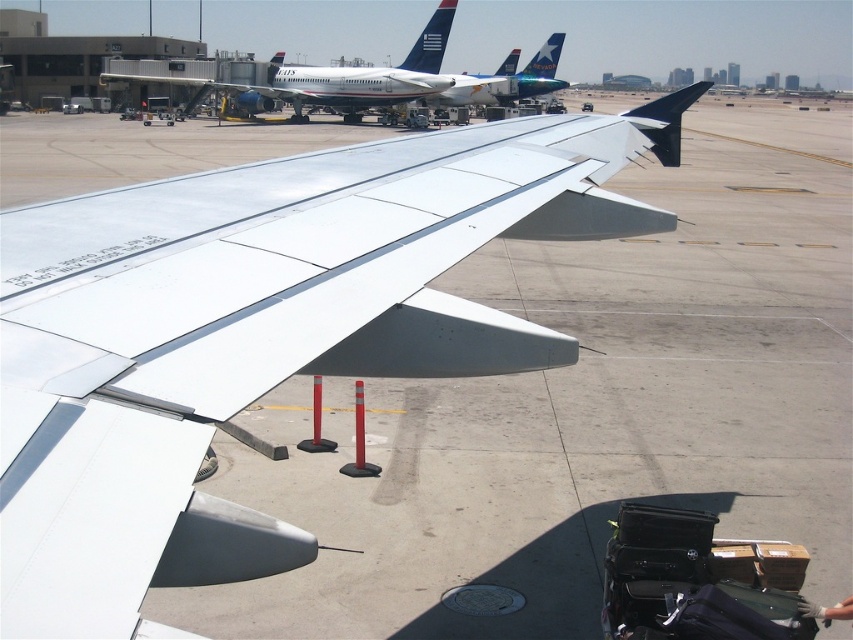
Question: Can you confirm if white matte wing at center is smaller than metallic blue airplane at upper center?

Choices:
 (A) yes
 (B) no

Answer: (A)

Question: Does black hardshell suitcase at lower right have a greater width compared to white matte airplane at upper center?

Choices:
 (A) no
 (B) yes

Answer: (A)

Question: Based on their relative distances, which object is nearer to the blue glossy tail at upper center?

Choices:
 (A) white matte wing at center
 (B) black hardshell suitcase at lower right

Answer: (A)

Question: Among these objects, which one is farthest from the camera?

Choices:
 (A) black hardshell suitcase at lower right
 (B) metallic blue airplane at upper center
 (C) white matte wing at center
 (D) blue glossy tail at upper center

Answer: (D)

Question: Which object appears farthest from the camera in this image?

Choices:
 (A) white matte airplane at upper center
 (B) blue glossy tail at upper center
 (C) black hardshell suitcase at lower right

Answer: (B)

Question: Is white matte airplane at upper center bigger than blue glossy tail at upper center?

Choices:
 (A) no
 (B) yes

Answer: (B)